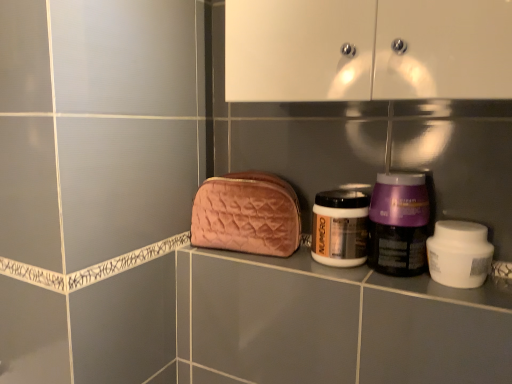
Question: In which direction should I rotate to look at matte gold jar at center, the second bottle positioned from the right?

Choices:
 (A) right
 (B) left

Answer: (A)

Question: From a real-world perspective, is white matte jar at right beneath purple glossy jar at center-right, the 1th bottle when ordered from right to left?

Choices:
 (A) no
 (B) yes

Answer: (B)

Question: Does white matte jar at right have a greater height compared to purple glossy jar at center-right, marked as the second bottle in a left-to-right arrangement?

Choices:
 (A) no
 (B) yes

Answer: (A)

Question: Can you confirm if white matte jar at right is shorter than purple glossy jar at center-right, the 1th bottle when ordered from right to left?

Choices:
 (A) no
 (B) yes

Answer: (B)

Question: Is white matte jar at right not inside purple glossy jar at center-right, the 1th bottle when ordered from right to left?

Choices:
 (A) yes
 (B) no

Answer: (A)

Question: Is white matte jar at right facing away from purple glossy jar at center-right, marked as the second bottle in a left-to-right arrangement?

Choices:
 (A) yes
 (B) no

Answer: (B)

Question: Does white matte jar at right lie behind purple glossy jar at center-right, the 1th bottle when ordered from right to left?

Choices:
 (A) yes
 (B) no

Answer: (B)

Question: Can you confirm if matte gold jar at center, the second bottle positioned from the right, is smaller than velvet pink pouch at center?

Choices:
 (A) no
 (B) yes

Answer: (B)

Question: Are matte gold jar at center, the first bottle in the left-to-right sequence, and velvet pink pouch at center far apart?

Choices:
 (A) yes
 (B) no

Answer: (B)

Question: Is matte gold jar at center, the second bottle positioned from the right, wider than velvet pink pouch at center?

Choices:
 (A) yes
 (B) no

Answer: (B)

Question: Is matte gold jar at center, the first bottle in the left-to-right sequence, thinner than velvet pink pouch at center?

Choices:
 (A) yes
 (B) no

Answer: (A)

Question: Is matte gold jar at center, the first bottle in the left-to-right sequence, positioned behind velvet pink pouch at center?

Choices:
 (A) yes
 (B) no

Answer: (B)

Question: Are matte gold jar at center, the second bottle positioned from the right, and velvet pink pouch at center making contact?

Choices:
 (A) yes
 (B) no

Answer: (B)

Question: Is velvet pink pouch at center oriented away from purple glossy jar at center-right, marked as the second bottle in a left-to-right arrangement?

Choices:
 (A) no
 (B) yes

Answer: (A)